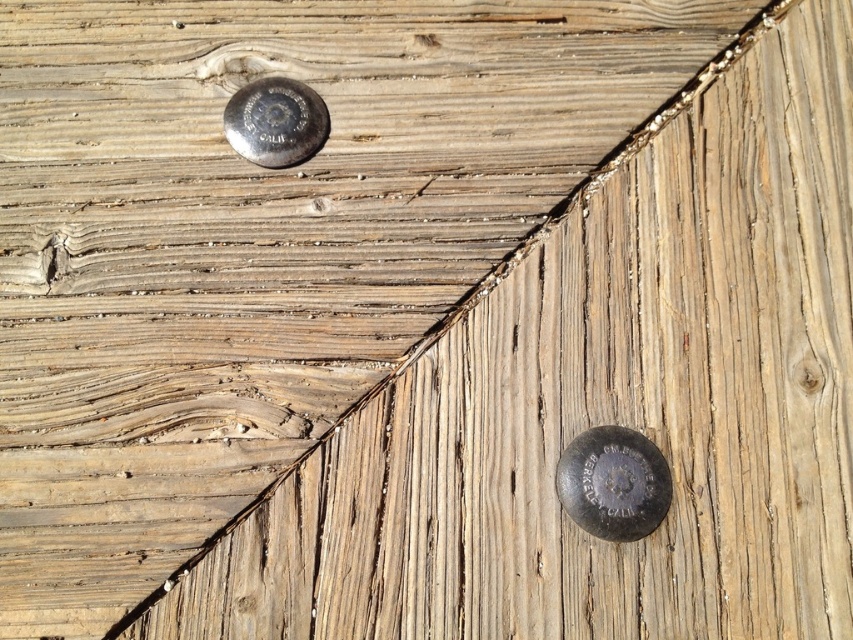
Question: Is matte silver bolt at lower right below shiny silver bolt at upper center?

Choices:
 (A) yes
 (B) no

Answer: (A)

Question: Which point is farther from the camera taking this photo?

Choices:
 (A) (309, 128)
 (B) (560, 468)

Answer: (A)

Question: Considering the relative positions of matte silver bolt at lower right and shiny silver bolt at upper center in the image provided, where is matte silver bolt at lower right located with respect to shiny silver bolt at upper center?

Choices:
 (A) left
 (B) right

Answer: (B)

Question: Which point is farther to the camera?

Choices:
 (A) (271, 122)
 (B) (646, 440)

Answer: (A)

Question: Is matte silver bolt at lower right positioned at the back of shiny silver bolt at upper center?

Choices:
 (A) yes
 (B) no

Answer: (B)